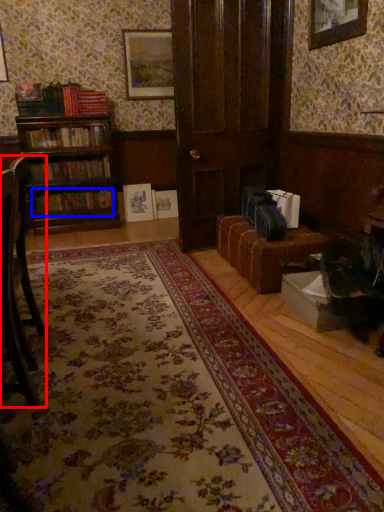
Question: Which point is closer to the camera, chair (highlighted by a red box) or book (highlighted by a blue box)?

Choices:
 (A) chair
 (B) book

Answer: (A)